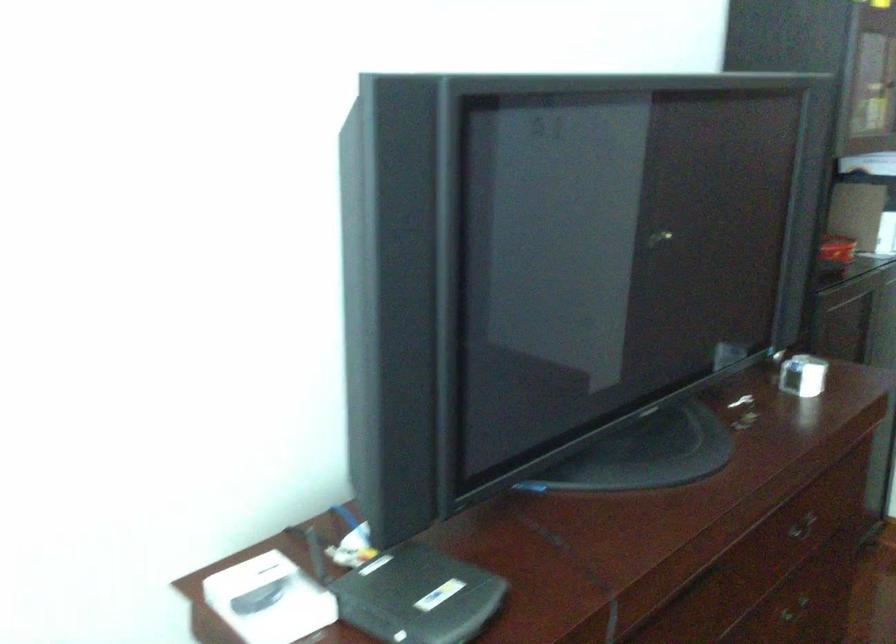
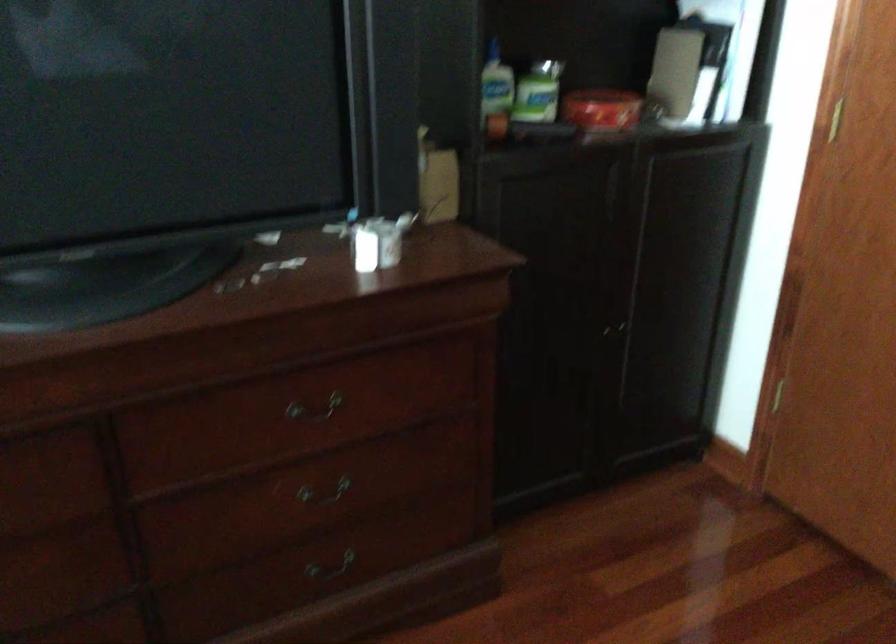
The point at (x=798, y=375) is marked in the first image. Where is the corresponding point in the second image?

(378, 242)